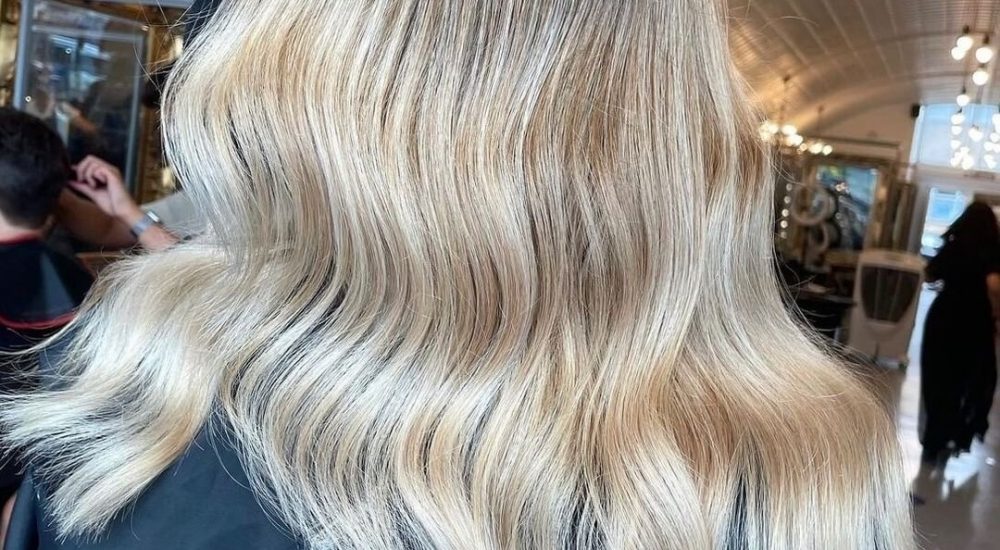
This screenshot has height=550, width=1000. What are the coordinates of `lightbulb` in the screenshot? It's located at (958, 157).